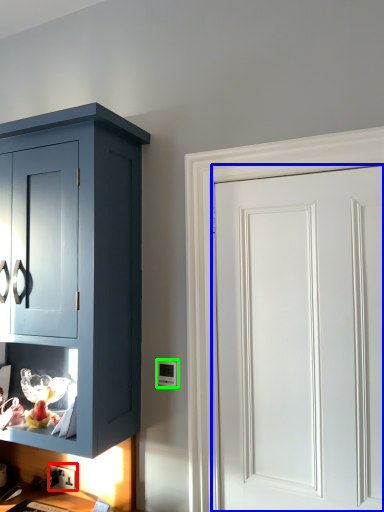
Question: Estimate the real-world distances between objects in this image. Which object is farther from electric outlet (highlighted by a red box), door (highlighted by a blue box) or light switch (highlighted by a green box)?

Choices:
 (A) door
 (B) light switch

Answer: (A)